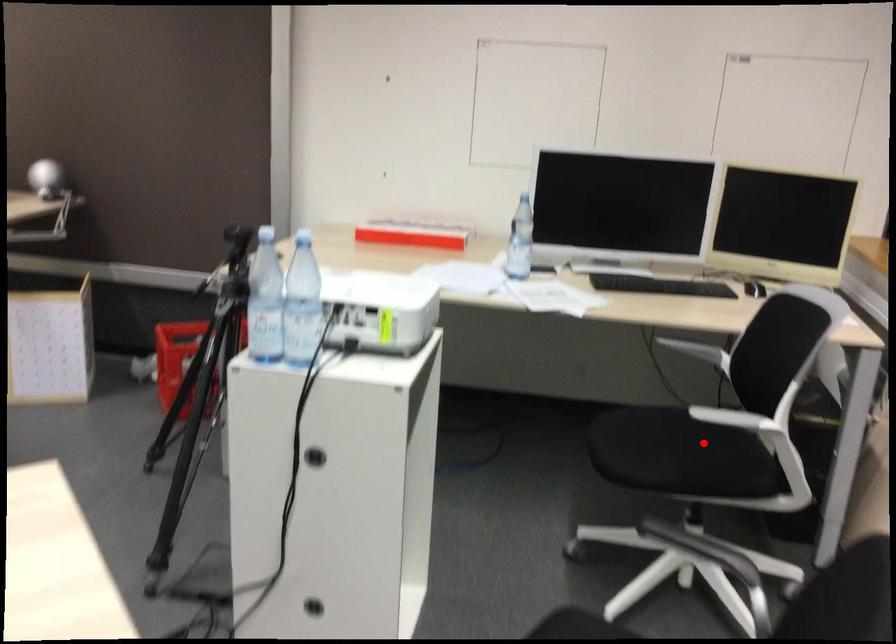
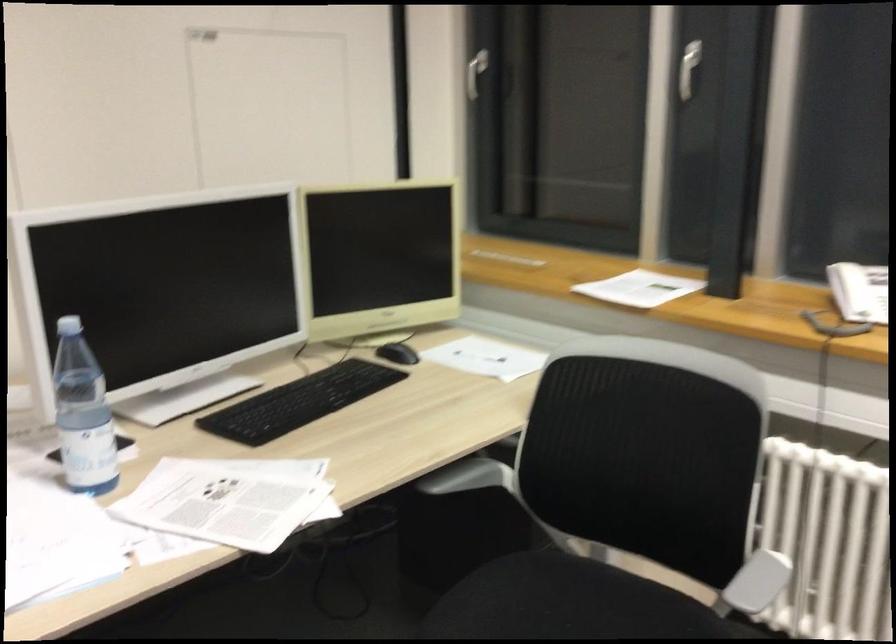
Question: I am providing you with two images of the same scene from different viewpoints. A red point is marked on the first image. Can you still see the location of the red point in image 2?

Choices:
 (A) Yes
 (B) No

Answer: (A)